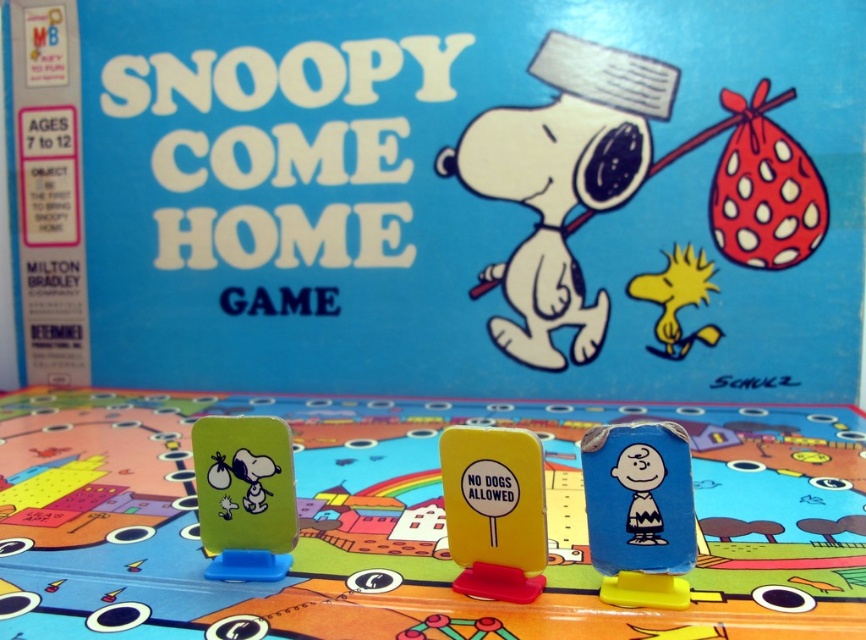
Does matte plastic snoopy figure at center appear under green matte plastic snoopy at left?

Incorrect, matte plastic snoopy figure at center is not positioned below green matte plastic snoopy at left.

This screenshot has height=640, width=866. Describe the element at coordinates (409, 522) in the screenshot. I see `matte plastic snoopy figure at center` at that location.

The image size is (866, 640). Identify the location of matte plastic snoopy figure at center. [409, 522].

In the scene shown: Which is more to the right, blue matte charlie brown figure at center or green matte plastic snoopy at left?

blue matte charlie brown figure at center

Who is shorter, blue matte charlie brown figure at center or green matte plastic snoopy at left?

green matte plastic snoopy at left is shorter.

Describe the element at coordinates (638, 512) in the screenshot. I see `blue matte charlie brown figure at center` at that location.

Where is `blue matte charlie brown figure at center`? blue matte charlie brown figure at center is located at coordinates pos(638,512).

Does matte green card at center appear on the left side of blue matte charlie brown figure at center?

Yes, matte green card at center is to the left of blue matte charlie brown figure at center.

Between matte green card at center and blue matte charlie brown figure at center, which one appears on the left side from the viewer's perspective?

matte green card at center is more to the left.

Is point (535, 38) positioned after point (656, 554)?

Yes, point (535, 38) is behind point (656, 554).

Locate an element on the screen. Image resolution: width=866 pixels, height=640 pixels. matte green card at center is located at coordinates (438, 195).